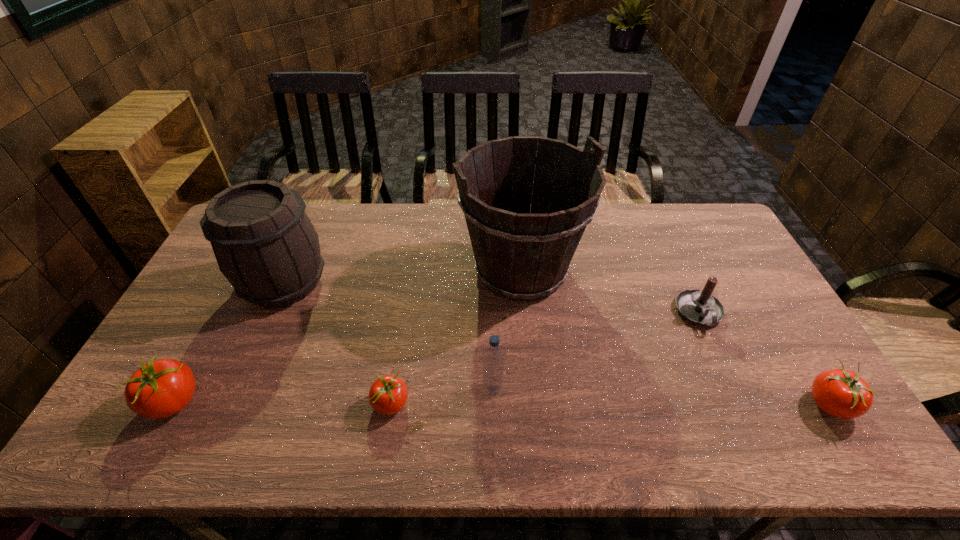
This screenshot has width=960, height=540. Identify the location of empty location between the water bottle and the tallest tomato. (333, 396).

This screenshot has width=960, height=540. I want to click on vacant area that lies between the third tallest object and the candle, so click(x=596, y=350).

At what (x,y) coordinates should I click in order to perform the action: click on empty space between the water bottle and the second tallest object. Please return your answer as a coordinate pair (x, y). The width and height of the screenshot is (960, 540). Looking at the image, I should click on (388, 335).

Where is `empty location between the candle and the second shortest tomato`? Image resolution: width=960 pixels, height=540 pixels. empty location between the candle and the second shortest tomato is located at coordinates (764, 359).

I want to click on vacant space in between the sixth shortest object and the second shortest tomato, so click(557, 343).

You are a GUI agent. You are given a task and a screenshot of the screen. Output one action in this format:
    pyautogui.click(x=<x>, y=<y>)
    Task: Click on the vacant region between the tallest tomato and the sixth object from left to right
    The height and width of the screenshot is (540, 960).
    Given the screenshot: What is the action you would take?
    pyautogui.click(x=436, y=358)

This screenshot has height=540, width=960. I want to click on vacant space in between the bucket and the sixth object from left to right, so click(610, 292).

Identify the location of vacant space that is in between the rightmost tomato and the water bottle. (660, 396).

This screenshot has width=960, height=540. I want to click on empty location between the third tallest object and the wine bucket, so click(x=388, y=335).

Identify which object is the closest to the shortest tomato. Please provide its 2D coordinates. Your answer should be formatted as a tuple, i.e. [(x, y)], where the tuple contains the x and y coordinates of a point satisfying the conditions above.

[(493, 358)]